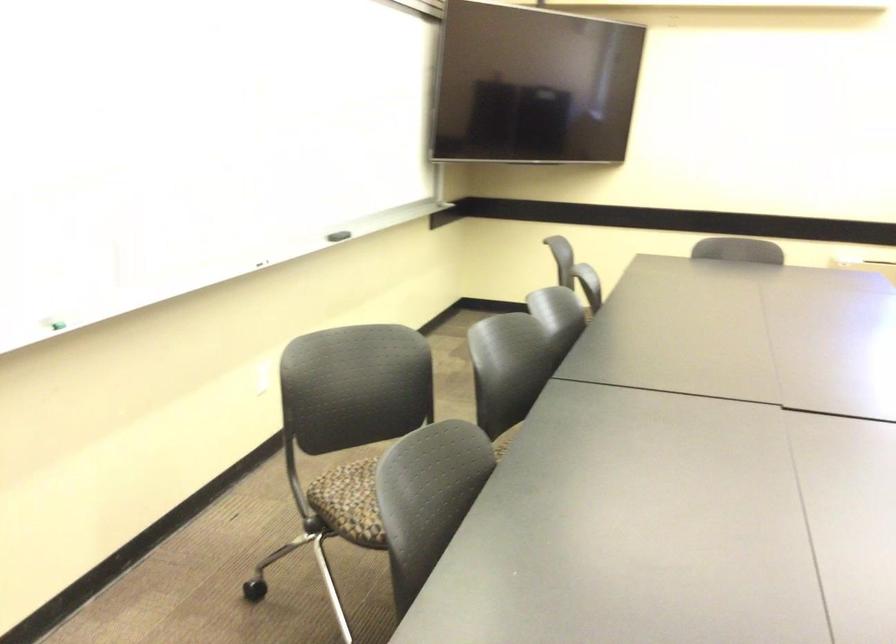
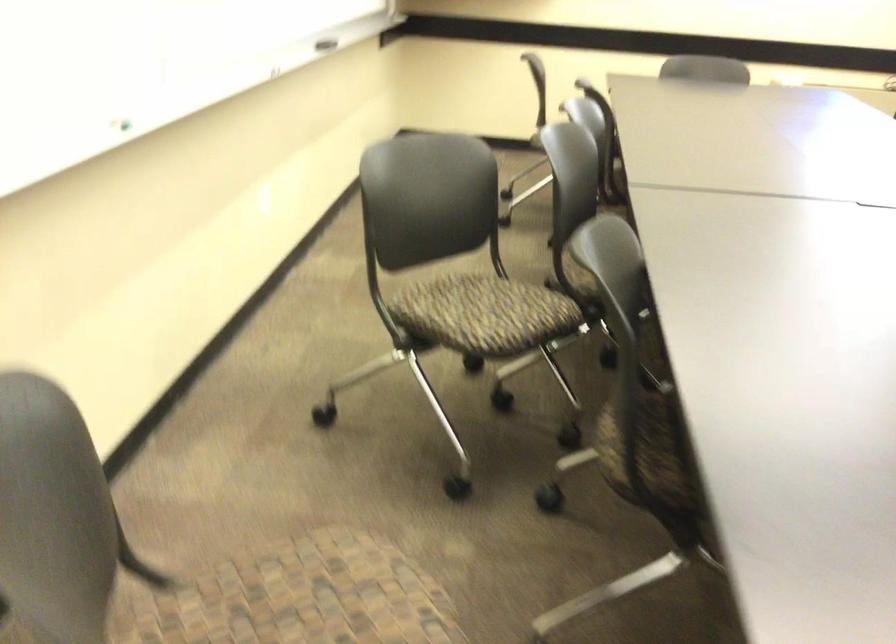
Question: Which direction would the cameraman need to move to produce the second image? Reply with the corresponding letter.

Choices:
 (A) Left
 (B) Right
 (C) Forward
 (D) Backward

Answer: (A)